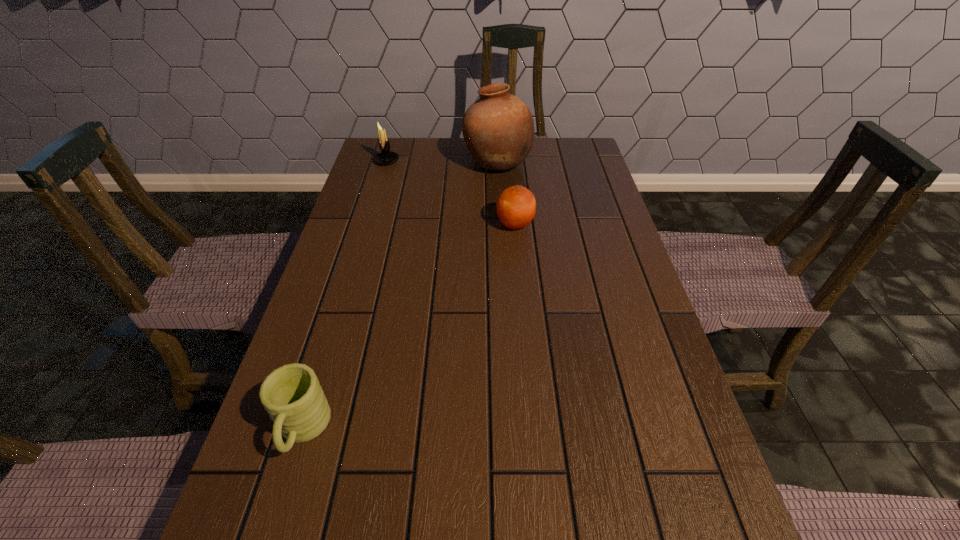
Locate an element on the screen. Image resolution: width=960 pixels, height=540 pixels. the tallest object is located at coordinates (498, 129).

Image resolution: width=960 pixels, height=540 pixels. Find the location of `candle holder`. candle holder is located at coordinates (385, 157).

Where is `the third farthest object`? the third farthest object is located at coordinates (516, 206).

Find the location of a particular element. mug is located at coordinates (291, 394).

Identify the location of free space located 0.330m on the left of the tallest object. This screenshot has width=960, height=540. (364, 163).

Find the location of `free spot located on the right of the candle holder`. free spot located on the right of the candle holder is located at coordinates (426, 161).

Where is `free location located 0.370m on the left of the third farthest object`? free location located 0.370m on the left of the third farthest object is located at coordinates (364, 225).

I want to click on vacant position located on the side of the nearest object with the handle, so click(273, 526).

The height and width of the screenshot is (540, 960). What are the coordinates of `pottery situated at the far edge` in the screenshot? It's located at (498, 129).

This screenshot has width=960, height=540. I want to click on candle holder located in the far edge section of the desktop, so pyautogui.click(x=385, y=157).